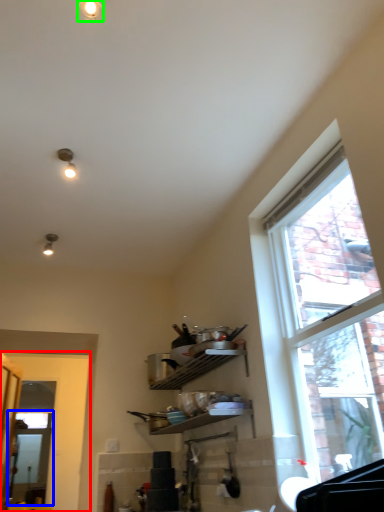
Question: Which object is the closest to the door (highlighted by a red box)? Choose among these: screen door (highlighted by a blue box) or light fixture (highlighted by a green box).

Choices:
 (A) screen door
 (B) light fixture

Answer: (A)